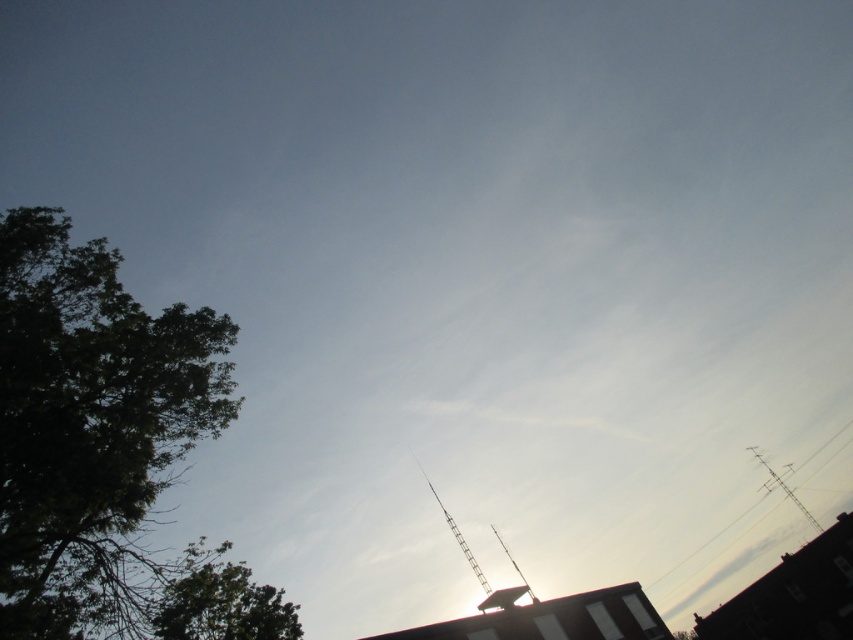
Question: Which point appears closest to the camera in this image?

Choices:
 (A) (735, 516)
 (B) (146, 352)

Answer: (B)

Question: Is green leafy tree at lower left below metallic wire at upper right?

Choices:
 (A) yes
 (B) no

Answer: (B)

Question: Considering the real-world distances, which object is farthest from the green leafy tree at lower left?

Choices:
 (A) green leafy tree at left
 (B) metallic wire at upper right

Answer: (B)

Question: Does green leafy tree at lower left appear on the left side of metallic wire at upper right?

Choices:
 (A) no
 (B) yes

Answer: (B)

Question: Which of the following is the closest to the observer?

Choices:
 (A) (28, 589)
 (B) (180, 616)

Answer: (A)

Question: Is green leafy tree at left bigger than green leafy tree at lower left?

Choices:
 (A) yes
 (B) no

Answer: (B)